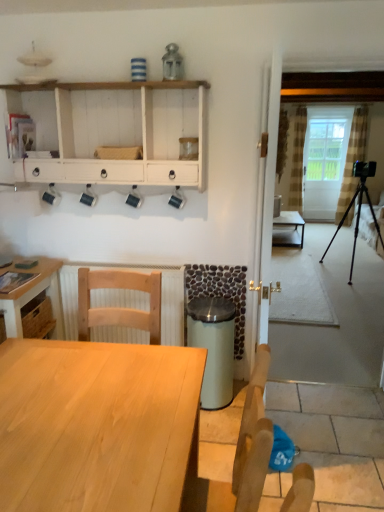
Question: Can you confirm if light wood chair at lower left is taller than white glass screen door at center?

Choices:
 (A) no
 (B) yes

Answer: (A)

Question: From the image's perspective, would you say light wood chair at lower left is shown under white glass screen door at center?

Choices:
 (A) no
 (B) yes

Answer: (B)

Question: Is light wood chair at lower left at the left side of white glass screen door at center?

Choices:
 (A) no
 (B) yes

Answer: (B)

Question: Is light wood chair at lower left directly adjacent to white glass screen door at center?

Choices:
 (A) no
 (B) yes

Answer: (A)

Question: Is the depth of light wood chair at lower left less than that of white glass screen door at center?

Choices:
 (A) no
 (B) yes

Answer: (B)

Question: Relative to light wood chair at lower left, is white glass screen door at center in front or behind?

Choices:
 (A) front
 (B) behind

Answer: (B)

Question: Considering the positions of point (309, 169) and point (158, 290), is point (309, 169) closer or farther from the camera than point (158, 290)?

Choices:
 (A) farther
 (B) closer

Answer: (A)

Question: From a real-world perspective, is white glass screen door at center above or below light wood chair at lower left?

Choices:
 (A) above
 (B) below

Answer: (A)

Question: In terms of width, does white glass screen door at center look wider or thinner when compared to light wood chair at lower left?

Choices:
 (A) thin
 (B) wide

Answer: (A)

Question: Visually, is light wood chair at lower left positioned to the left or to the right of matte black table at center, the first table when ordered from top to bottom?

Choices:
 (A) left
 (B) right

Answer: (A)

Question: Is point [x=129, y=287] closer or farther from the camera than point [x=296, y=226]?

Choices:
 (A) closer
 (B) farther

Answer: (A)

Question: From the image's perspective, relative to matte black table at center, which is counted as the 1th table, starting from the right, is light wood chair at lower left above or below?

Choices:
 (A) above
 (B) below

Answer: (B)

Question: In the image, is light wood chair at lower left positioned in front of or behind matte black table at center, placed as the 3th table when sorted from bottom to top?

Choices:
 (A) front
 (B) behind

Answer: (A)

Question: Considering the relative positions of matte black table at center, which is counted as the 1th table, starting from the right, and light wood table at lower left, which is the first table from left to right, in the image provided, is matte black table at center, which is counted as the 1th table, starting from the right, to the left or to the right of light wood table at lower left, which is the first table from left to right,?

Choices:
 (A) right
 (B) left

Answer: (A)

Question: Is matte black table at center, which is counted as the third table, starting from the left, inside the boundaries of light wood table at lower left, the second table when ordered from bottom to top, or outside?

Choices:
 (A) outside
 (B) inside

Answer: (A)